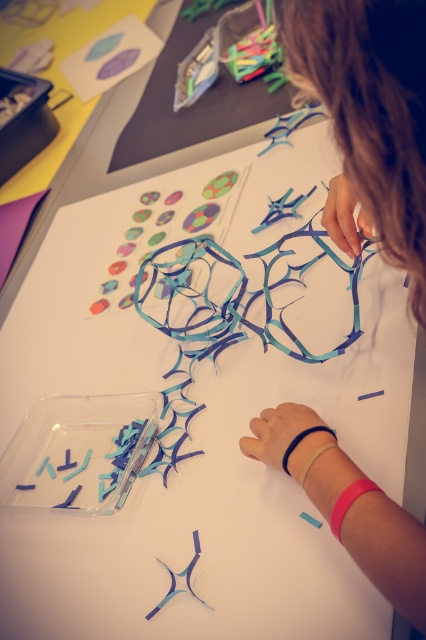
You are trying to organize your crafting materials. You have two containers on your table, the teal matte plastic at center and the translucent blue plastic at center. Which container can hold more paper strips if they are the same size?

The teal matte plastic at center can hold more paper strips because its width is larger than the translucent blue plastic at center, providing more space for storage.